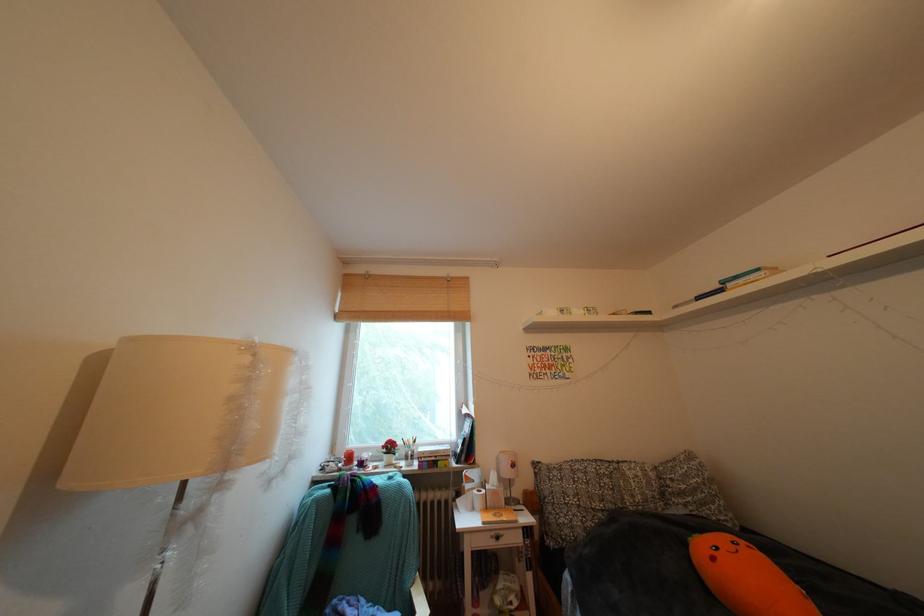
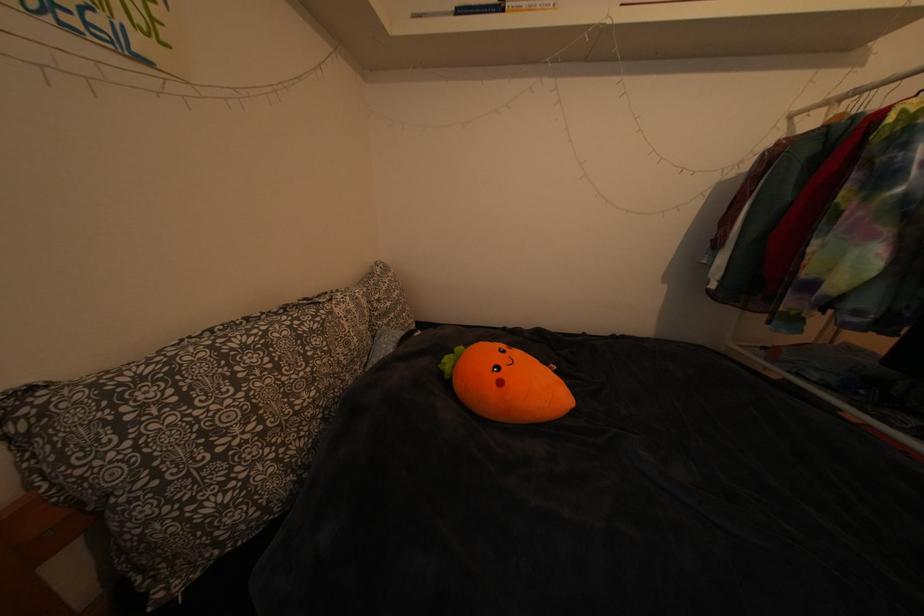
Find the pixel in the second image that matches point (723, 564) in the first image.

(511, 389)